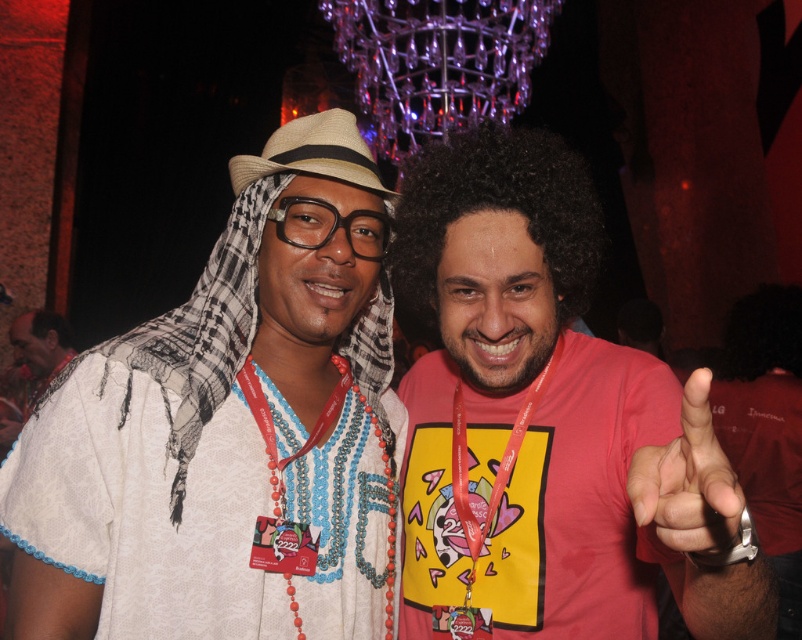
Is point (286, 264) behind point (248, 163)?

Yes, point (286, 264) is farther from viewer.

This screenshot has width=802, height=640. Describe the element at coordinates (229, 429) in the screenshot. I see `white woven cloth at left` at that location.

The width and height of the screenshot is (802, 640). I want to click on white woven cloth at left, so click(229, 429).

Where is `white woven cloth at left`? white woven cloth at left is located at coordinates (229, 429).

Is pink matte finger at center to the right of beige straw cowboy hat at center from the viewer's perspective?

Yes, pink matte finger at center is to the right of beige straw cowboy hat at center.

Is pink matte finger at center taller than beige straw cowboy hat at center?

Incorrect, pink matte finger at center's height is not larger of beige straw cowboy hat at center's.

You are a GUI agent. You are given a task and a screenshot of the screen. Output one action in this format:
    pyautogui.click(x=<x>, y=<y>)
    Task: Click on the pink matte finger at center
    This screenshot has height=640, width=802.
    Given the screenshot: What is the action you would take?
    pyautogui.click(x=687, y=481)

Does white woven cloth at left come in front of pink matte finger at center?

No, white woven cloth at left is further to the viewer.

Can you confirm if white woven cloth at left is positioned above pink matte finger at center?

Yes, white woven cloth at left is above pink matte finger at center.

This screenshot has height=640, width=802. I want to click on white woven cloth at left, so click(x=229, y=429).

Locate an element on the screen. Image resolution: width=802 pixels, height=640 pixels. white woven cloth at left is located at coordinates (229, 429).